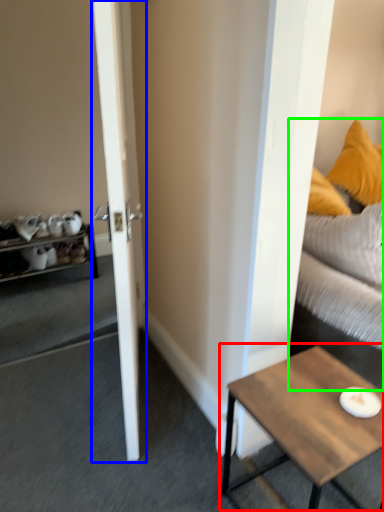
Question: Based on their relative distances, which object is nearer to coffee table (highlighted by a red box)? Choose from door (highlighted by a blue box) and studio couch (highlighted by a green box).

Choices:
 (A) door
 (B) studio couch

Answer: (B)